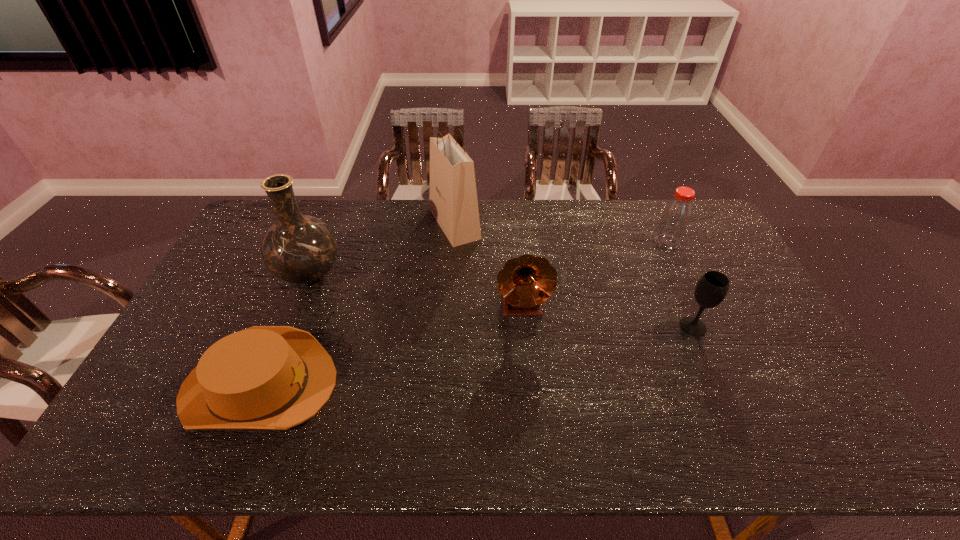
Identify the location of free region that satisfies the following two spatial constraints: 1. on the front side of the vase; 2. on the front-facing side of the cowboy hat. The width and height of the screenshot is (960, 540). (265, 385).